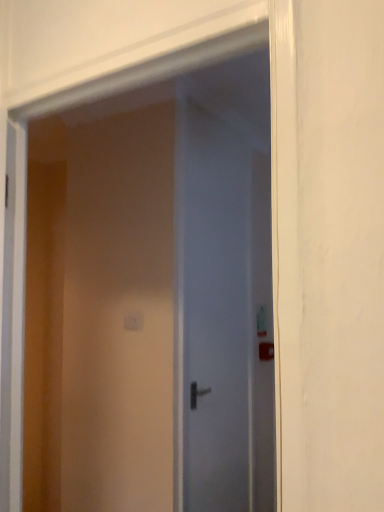
Image resolution: width=384 pixels, height=512 pixels. What do you see at coordinates (133, 320) in the screenshot? I see `white plastic light switch at center` at bounding box center [133, 320].

You are a GUI agent. You are given a task and a screenshot of the screen. Output one action in this format:
    pyautogui.click(x=<x>, y=<y>)
    Task: Click on the white plastic light switch at center
    
    Given the screenshot: What is the action you would take?
    pyautogui.click(x=133, y=320)

Locate an element on the screen. This screenshot has height=512, width=384. white glossy door at center, the first door positioned from the front is located at coordinates 151,279.

From a real-world perspective, who is located higher, white glossy door at center, the first door positioned from the front, or white plastic light switch at center?

From a 3D spatial view, white glossy door at center, the first door positioned from the front, is above.

Is white glossy door at center, which is the 2th door in back-to-front order, situated inside white plastic light switch at center or outside?

The correct answer is: outside.

Consider the image. Is white glossy door at center, which is the 2th door in back-to-front order, positioned with its back to white plastic light switch at center?

That's not correct — white glossy door at center, which is the 2th door in back-to-front order, is not looking away from white plastic light switch at center.

Looking at this image, how distant is white glossy door at center, which is the 2th door in back-to-front order, from white plastic light switch at center?

white glossy door at center, which is the 2th door in back-to-front order, and white plastic light switch at center are 30.62 inches apart from each other.

Is satin white door at center, which is the second door from front to back, taller than white glossy door at center, which is the 2th door in back-to-front order?

Yes.

Which is closer to the camera, (247, 492) or (150, 426)?

Clearly, point (247, 492) is more distant from the camera than point (150, 426).

Are white plastic light switch at center and satin white door at center, which is the second door from front to back, located far from each other?

white plastic light switch at center is near satin white door at center, which is the second door from front to back, not far away.

Does white plastic light switch at center have a lesser width compared to satin white door at center, which is the second door from front to back?

Indeed, white plastic light switch at center has a lesser width compared to satin white door at center, which is the second door from front to back.

Starting from the white plastic light switch at center, which door is the 2nd one to the right? Please provide its 2D coordinates.

[(223, 297)]

From a real-world perspective, does white plastic light switch at center stand above white glossy door at center, which is the 2th door in back-to-front order?

No, from a real-world perspective, white plastic light switch at center is not above white glossy door at center, which is the 2th door in back-to-front order.

Does white plastic light switch at center have a smaller size compared to white glossy door at center, which is the 2th door in back-to-front order?

Correct, white plastic light switch at center occupies less space than white glossy door at center, which is the 2th door in back-to-front order.

Does white plastic light switch at center have a greater height compared to white glossy door at center, which is the 2th door in back-to-front order?

No.

Measure the distance from satin white door at center, which is the second door from front to back, to white plastic light switch at center.

satin white door at center, which is the second door from front to back, is 30.19 inches from white plastic light switch at center.

Does satin white door at center, which is the second door from front to back, come behind white plastic light switch at center?

No, satin white door at center, which is the second door from front to back, is closer to the camera.

The image size is (384, 512). Identify the location of door located underneath the white plastic light switch at center (from a real-world perspective). click(223, 297).

Between satin white door at center, which is the second door from front to back, and white plastic light switch at center, which one has more height?

With more height is satin white door at center, which is the second door from front to back.

Between white glossy door at center, which is the 2th door in back-to-front order, and satin white door at center, which is the second door from front to back, which one has smaller width?

satin white door at center, which is the second door from front to back.

Looking at this image, from the image's perspective, is white glossy door at center, which is the 2th door in back-to-front order, above or below satin white door at center, which is the 1th door from back to front?

From the image's perspective, white glossy door at center, which is the 2th door in back-to-front order, appears above satin white door at center, which is the 1th door from back to front.

Are white glossy door at center, which is the 2th door in back-to-front order, and satin white door at center, which is the second door from front to back, far apart?

No, white glossy door at center, which is the 2th door in back-to-front order, is in close proximity to satin white door at center, which is the second door from front to back.

Which object is further away from the camera, white glossy door at center, the first door positioned from the front, or satin white door at center, which is the 1th door from back to front?

satin white door at center, which is the 1th door from back to front, is further away from the camera.

Identify the location of door located above the white plastic light switch at center (from a real-world perspective). This screenshot has height=512, width=384. (151, 279).

You are a GUI agent. You are given a task and a screenshot of the screen. Output one action in this format:
    pyautogui.click(x=<x>, y=<y>)
    Task: Click on the door behind the white glossy door at center, which is the 2th door in back-to-front order
    This screenshot has width=384, height=512.
    Given the screenshot: What is the action you would take?
    pyautogui.click(x=223, y=297)

Based on their spatial positions, is white plastic light switch at center or satin white door at center, which is the 1th door from back to front, closer to white glossy door at center, the first door positioned from the front?

satin white door at center, which is the 1th door from back to front, lies closer to white glossy door at center, the first door positioned from the front, than the other object.

Estimate the real-world distances between objects in this image. Which object is further from satin white door at center, which is the 1th door from back to front, white plastic light switch at center or white glossy door at center, the first door positioned from the front?

Among the two, white plastic light switch at center is located further to satin white door at center, which is the 1th door from back to front.

Which object lies nearer to the anchor point white glossy door at center, which is the 2th door in back-to-front order, satin white door at center, which is the second door from front to back, or white plastic light switch at center?

satin white door at center, which is the second door from front to back, is closer to white glossy door at center, which is the 2th door in back-to-front order.

Based on their spatial positions, is satin white door at center, which is the 1th door from back to front, or white glossy door at center, the first door positioned from the front, further from white plastic light switch at center?

Based on the image, white glossy door at center, the first door positioned from the front, appears to be further to white plastic light switch at center.

Looking at the image, which one is located further to satin white door at center, which is the second door from front to back, white glossy door at center, the first door positioned from the front, or white plastic light switch at center?

white plastic light switch at center is positioned further to the anchor satin white door at center, which is the second door from front to back.

Estimate the real-world distances between objects in this image. Which object is closer to white plastic light switch at center, white glossy door at center, the first door positioned from the front, or satin white door at center, which is the second door from front to back?

satin white door at center, which is the second door from front to back, lies closer to white plastic light switch at center than the other object.

What are the coordinates of `door located between white glossy door at center, the first door positioned from the front, and white plastic light switch at center in the depth direction` in the screenshot? It's located at (223, 297).